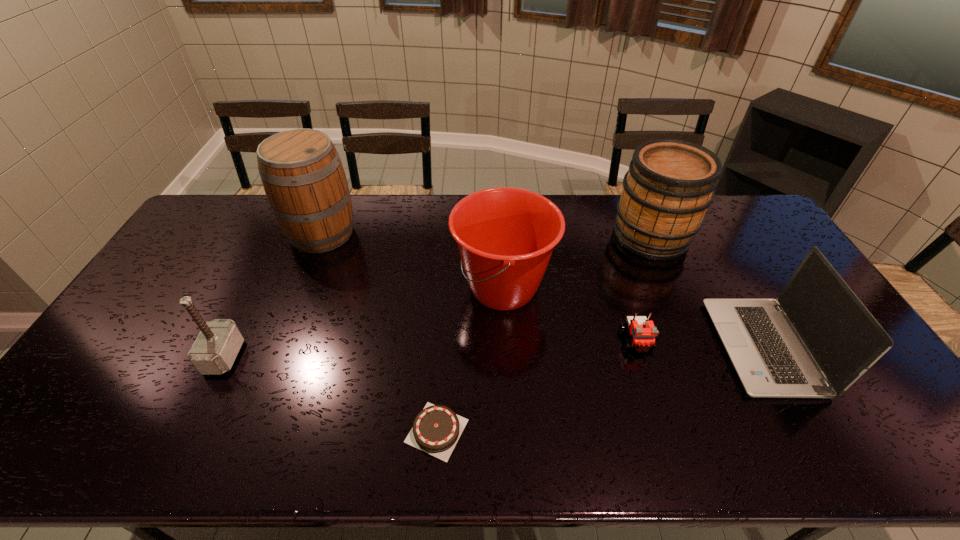
Image resolution: width=960 pixels, height=540 pixels. Identify the location of the left cider. (301, 171).

At what (x,y) coordinates should I click in order to perform the action: click on the right cider. Please return your answer as a coordinate pair (x, y). This screenshot has height=540, width=960. Looking at the image, I should click on (670, 183).

This screenshot has height=540, width=960. What are the coordinates of `bucket` in the screenshot? It's located at (505, 236).

I want to click on laptop computer, so click(817, 339).

In order to click on hammer in this screenshot , I will do `click(214, 351)`.

The image size is (960, 540). I want to click on the sixth tallest object, so click(x=643, y=331).

Locate an element on the screen. The image size is (960, 540). chocolate cake is located at coordinates pos(436,429).

You are a GUI agent. You are given a task and a screenshot of the screen. Output one action in this format:
    pyautogui.click(x=<x>, y=<y>)
    Task: Click on the nearest object
    Image resolution: width=960 pixels, height=540 pixels.
    Given the screenshot: What is the action you would take?
    pyautogui.click(x=436, y=429)

What are the coordinates of `vacant space situated on the back of the left cider` in the screenshot? It's located at (334, 202).

Image resolution: width=960 pixels, height=540 pixels. Find the location of `free point located 0.300m on the front of the right cider`. free point located 0.300m on the front of the right cider is located at coordinates (694, 336).